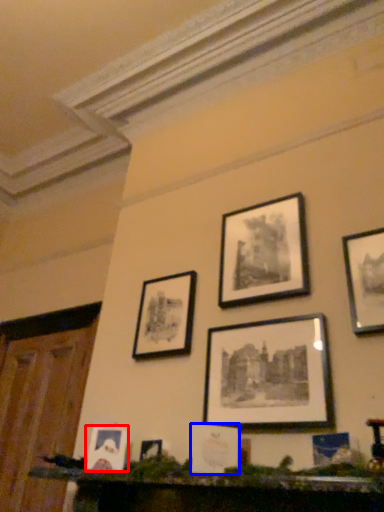
Question: Which object appears farthest to the camera in this image, picture frame (highlighted by a red box) or picture frame (highlighted by a blue box)?

Choices:
 (A) picture frame
 (B) picture frame

Answer: (A)